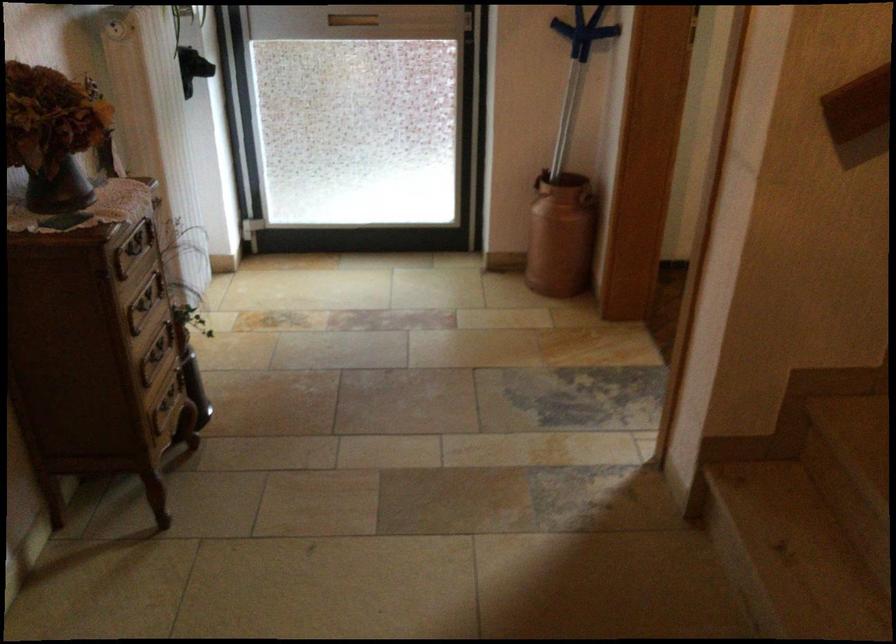
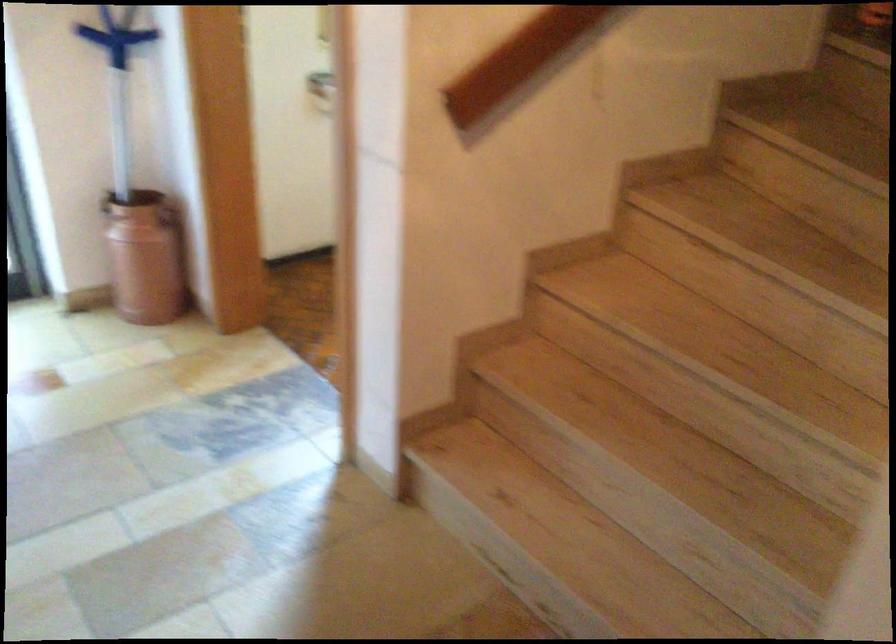
Locate, in the second image, the point that corresponds to point 581,199 in the first image.

(168, 216)